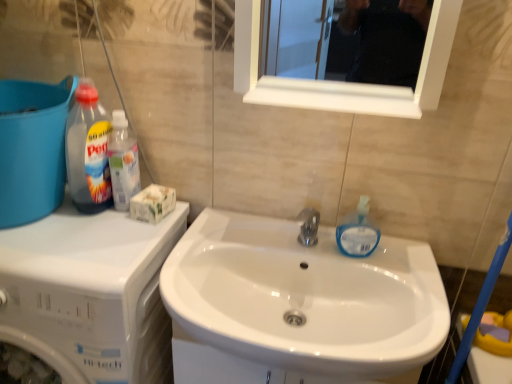
Locate an element on the screen. This screenshot has height=384, width=512. vacant space that is to the left of translucent blue liquid soap at sink right, acting as the 3th cleaning product starting from the left is located at coordinates click(285, 236).